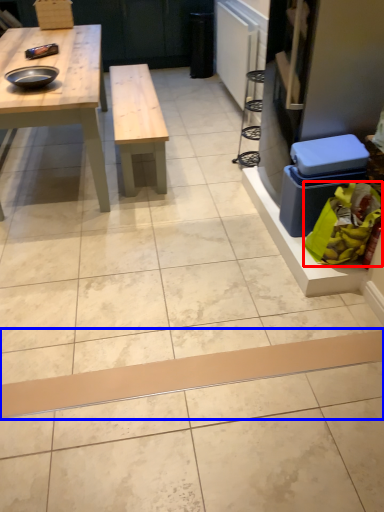
Question: Which object appears farthest to the camera in this image, food (highlighted by a red box) or plank (highlighted by a blue box)?

Choices:
 (A) food
 (B) plank

Answer: (A)